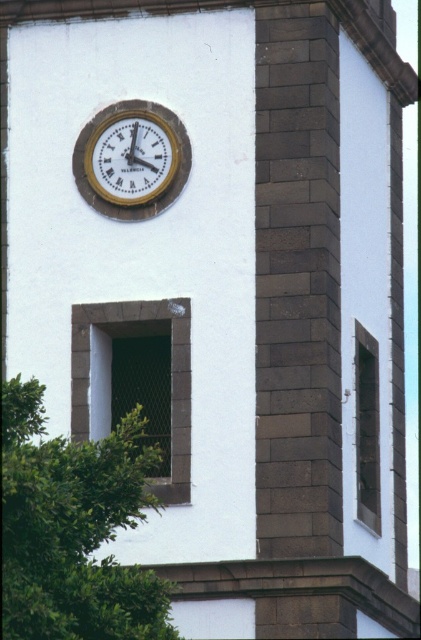
Which is more to the left, green leafy tree at lower left or gold metallic clock at upper center?

green leafy tree at lower left

At what (x,y) coordinates should I click in order to perform the action: click on green leafy tree at lower left. Please return your answer as a coordinate pair (x, y). The image size is (421, 640). Looking at the image, I should click on (74, 529).

Does point (104, 474) come closer to viewer compared to point (117, 156)?

Yes, it is in front of point (117, 156).

Find the location of a particular element. The image size is (421, 640). green leafy tree at lower left is located at coordinates click(x=74, y=529).